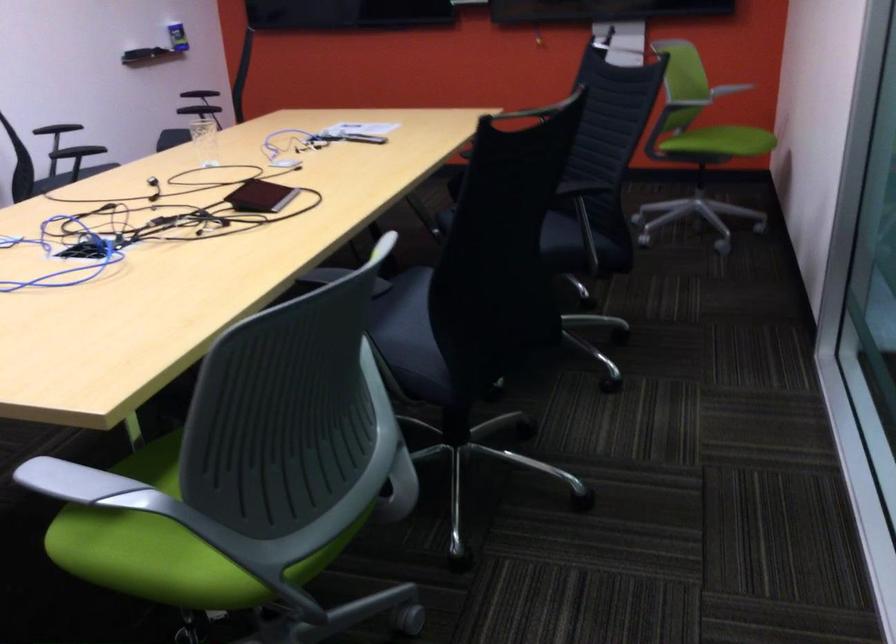
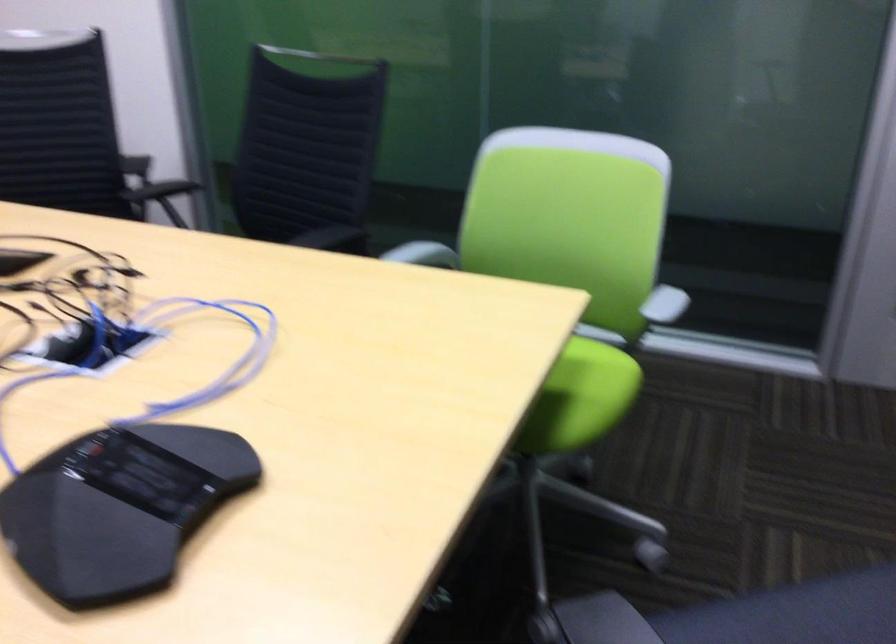
In the second image, find the point that corresponds to (x=108, y=560) in the first image.

(590, 392)